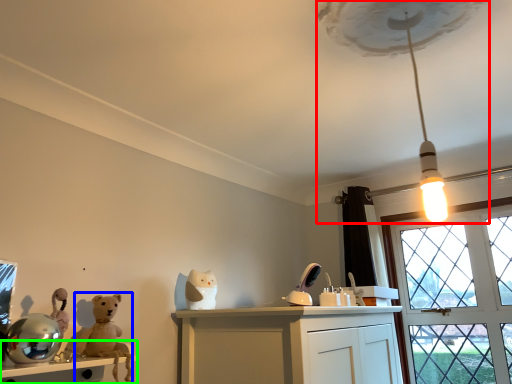
Question: Which object is the farthest from lamp (highlighted by a red box)? Choose among these: animal (highlighted by a blue box) or table (highlighted by a green box).

Choices:
 (A) animal
 (B) table

Answer: (B)